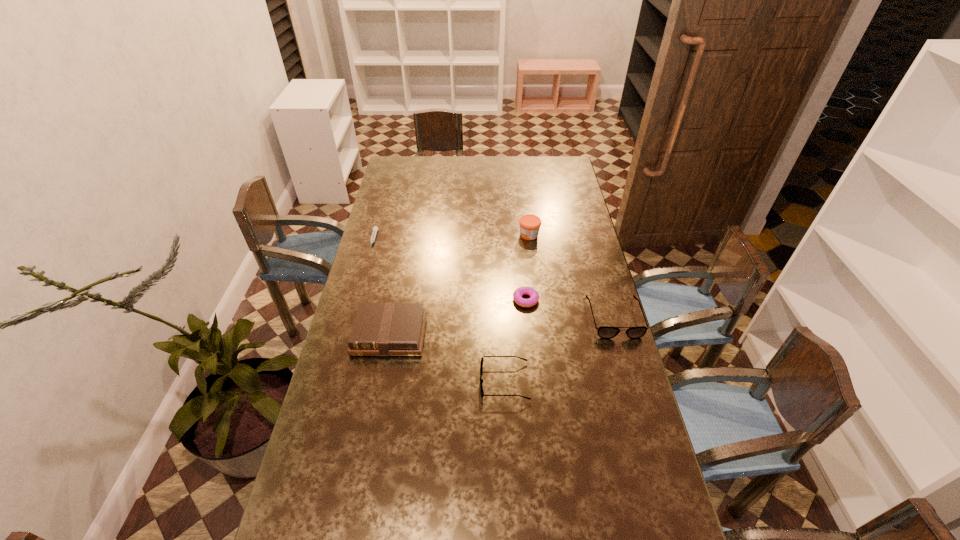
Identify the location of free space for a new spectacles on the left. (360, 464).